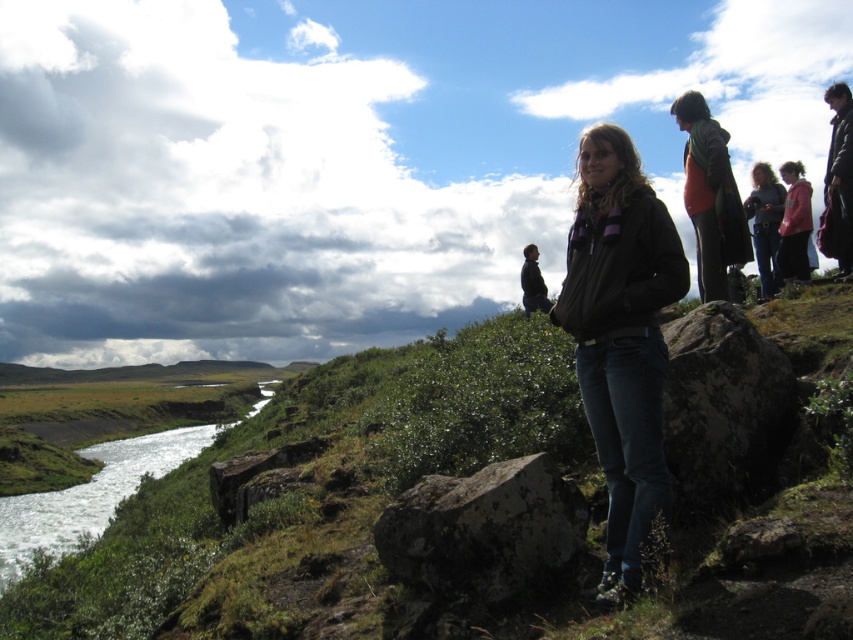
You are standing at point A and want to walk to point B. The coordinates of point A are point (756, 168) and point B are point (119, 486). According to the image, which direction should you move to reach point B from point A?

To reach point B from point A, you should move forward because point (119, 486) is behind point (756, 168), meaning it is in the same line of sight but further away in the direction you are facing.